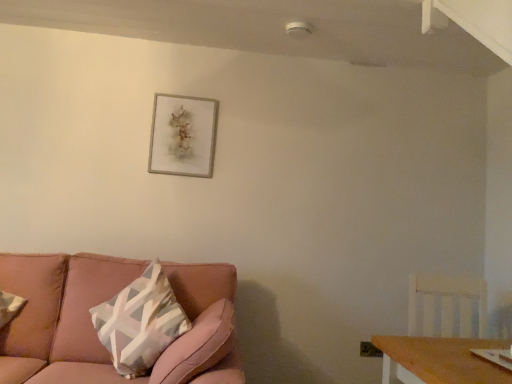
Question: Considering the relative sizes of white wood swivel chair at right and silver metallic picture frame at upper center in the image provided, is white wood swivel chair at right taller than silver metallic picture frame at upper center?

Choices:
 (A) yes
 (B) no

Answer: (B)

Question: Is the surface of white wood swivel chair at right in direct contact with silver metallic picture frame at upper center?

Choices:
 (A) no
 (B) yes

Answer: (A)

Question: Considering the relative sizes of white wood swivel chair at right and silver metallic picture frame at upper center in the image provided, is white wood swivel chair at right wider than silver metallic picture frame at upper center?

Choices:
 (A) no
 (B) yes

Answer: (B)

Question: Is white wood swivel chair at right not near silver metallic picture frame at upper center?

Choices:
 (A) yes
 (B) no

Answer: (A)

Question: Is white wood swivel chair at right bigger than silver metallic picture frame at upper center?

Choices:
 (A) yes
 (B) no

Answer: (A)

Question: Is point (198, 139) closer or farther from the camera than point (167, 379)?

Choices:
 (A) closer
 (B) farther

Answer: (B)

Question: In the image, is silver metallic picture frame at upper center positioned in front of or behind pink fabric couch at lower left?

Choices:
 (A) front
 (B) behind

Answer: (B)

Question: From a real-world perspective, is silver metallic picture frame at upper center positioned above or below pink fabric couch at lower left?

Choices:
 (A) below
 (B) above

Answer: (B)

Question: From the image's perspective, is silver metallic picture frame at upper center above or below pink fabric couch at lower left?

Choices:
 (A) below
 (B) above

Answer: (B)

Question: Relative to white wood swivel chair at right, is silver metallic picture frame at upper center in front or behind?

Choices:
 (A) front
 (B) behind

Answer: (B)

Question: Looking at the image, does silver metallic picture frame at upper center seem bigger or smaller compared to white wood swivel chair at right?

Choices:
 (A) big
 (B) small

Answer: (B)

Question: Considering the relative positions of silver metallic picture frame at upper center and white wood swivel chair at right in the image provided, is silver metallic picture frame at upper center to the left or to the right of white wood swivel chair at right?

Choices:
 (A) right
 (B) left

Answer: (B)

Question: Considering the positions of silver metallic picture frame at upper center and white wood swivel chair at right in the image, is silver metallic picture frame at upper center wider or thinner than white wood swivel chair at right?

Choices:
 (A) wide
 (B) thin

Answer: (B)

Question: Is white wood swivel chair at right wider or thinner than pink fabric couch at lower left?

Choices:
 (A) wide
 (B) thin

Answer: (B)

Question: From a real-world perspective, is white wood swivel chair at right above or below pink fabric couch at lower left?

Choices:
 (A) below
 (B) above

Answer: (B)